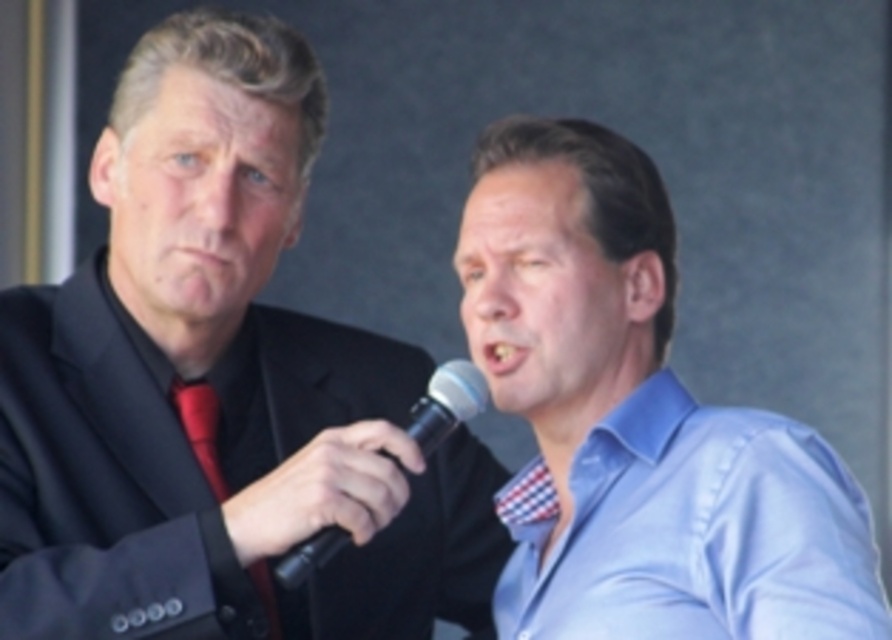
Is matte black suit at left further to camera compared to light blue satin shirt at center?

Yes.

Between matte black suit at left and light blue satin shirt at center, which one has more height?

With more height is matte black suit at left.

Is point (234, 465) more distant than point (584, 492)?

Yes.

Identify the location of matte black suit at left. (219, 388).

What do you see at coordinates (219, 388) in the screenshot?
I see `matte black suit at left` at bounding box center [219, 388].

Describe the element at coordinates (219, 388) in the screenshot. The height and width of the screenshot is (640, 892). I see `matte black suit at left` at that location.

Find the location of a particular element. The image size is (892, 640). matte black suit at left is located at coordinates (219, 388).

Is blue satin shirt at center to the right of red satin tie at left from the viewer's perspective?

Correct, you'll find blue satin shirt at center to the right of red satin tie at left.

Can you confirm if blue satin shirt at center is positioned below red satin tie at left?

Incorrect, blue satin shirt at center is not positioned below red satin tie at left.

Is point (880, 628) closer to camera compared to point (178, 388)?

That is True.

Where is `blue satin shirt at center`? blue satin shirt at center is located at coordinates (636, 420).